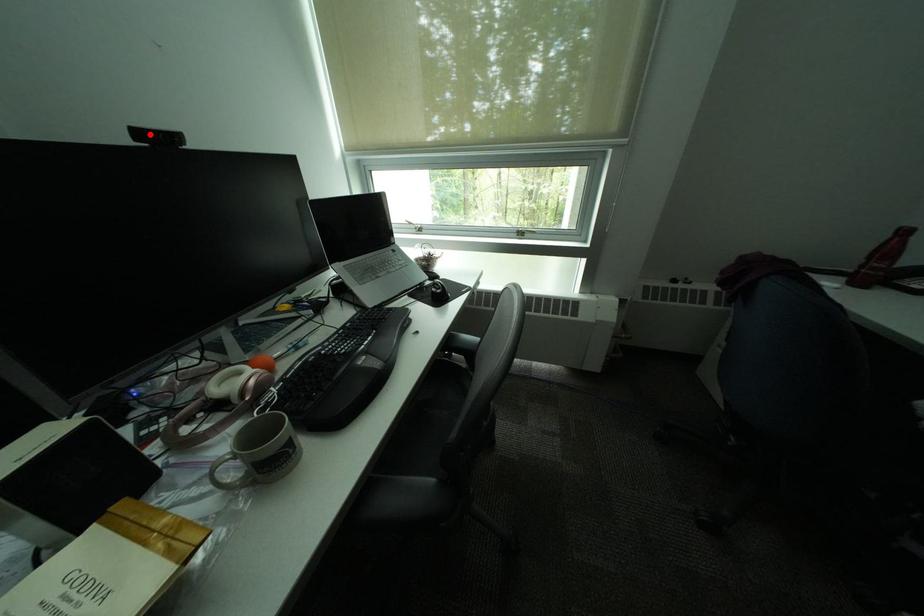
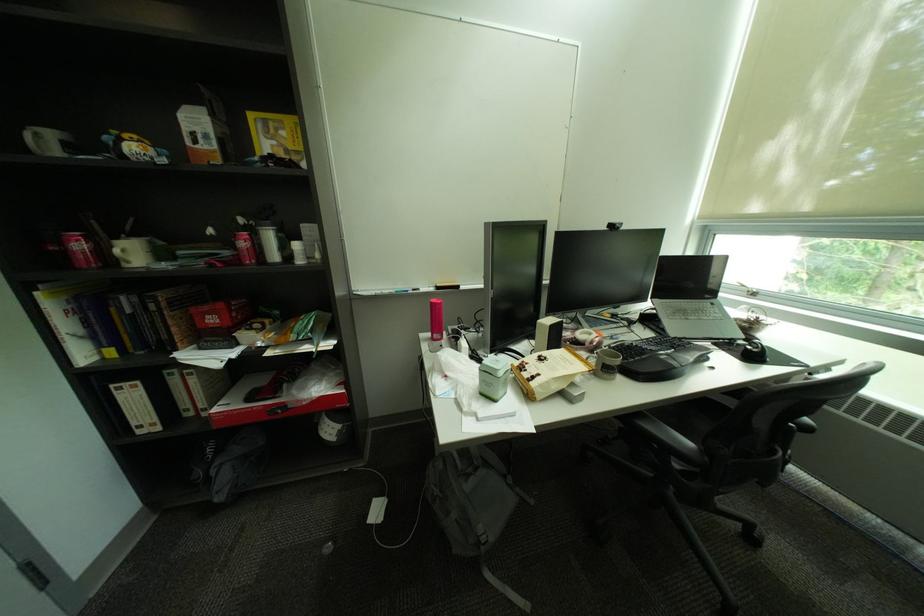
Where in the second image is the point corresponding to the highlighted location from the first image?

(621, 227)